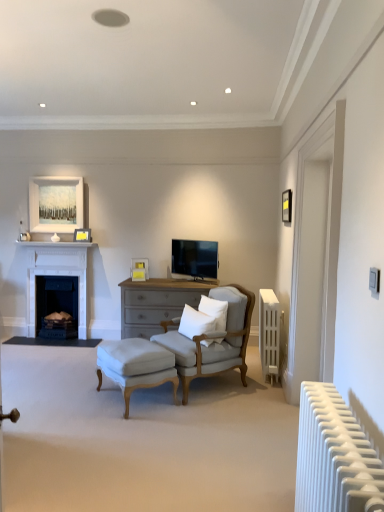
Question: Is point (76, 240) positioned closer to the camera than point (183, 387)?

Choices:
 (A) closer
 (B) farther

Answer: (B)

Question: In terms of size, does white matte picture frame at upper left, which appears as the 2th picture frame when ordered from the bottom, appear bigger or smaller than light gray fabric armchair at center?

Choices:
 (A) small
 (B) big

Answer: (A)

Question: Which object is the closest to the dark blue stone fireplace at left, the 1th fireplace from the bottom?

Choices:
 (A) white soft pillow at center, the second pillow when ordered from left to right
 (B) white cotton pillow at center, the 2th pillow in the right-to-left sequence
 (C) light gray fabric armchair at center
 (D) white painted wood fireplace at left, the first fireplace from the top
 (E) matte black picture frame at upper right, the third picture frame positioned from the bottom

Answer: (D)

Question: Which is nearer to the white matte picture frame at upper left, which ranks as the 1th picture frame in left-to-right order?

Choices:
 (A) matte black picture frame at upper right, the 3th picture frame from the left
 (B) white painted wood fireplace at left, the first fireplace from the top
 (C) white cotton pillow at center, the 2th pillow in the right-to-left sequence
 (D) white soft pillow at center, the first pillow positioned from the right
 (E) white plastic radiator at right, placed as the 1th radiator when sorted from back to front

Answer: (B)